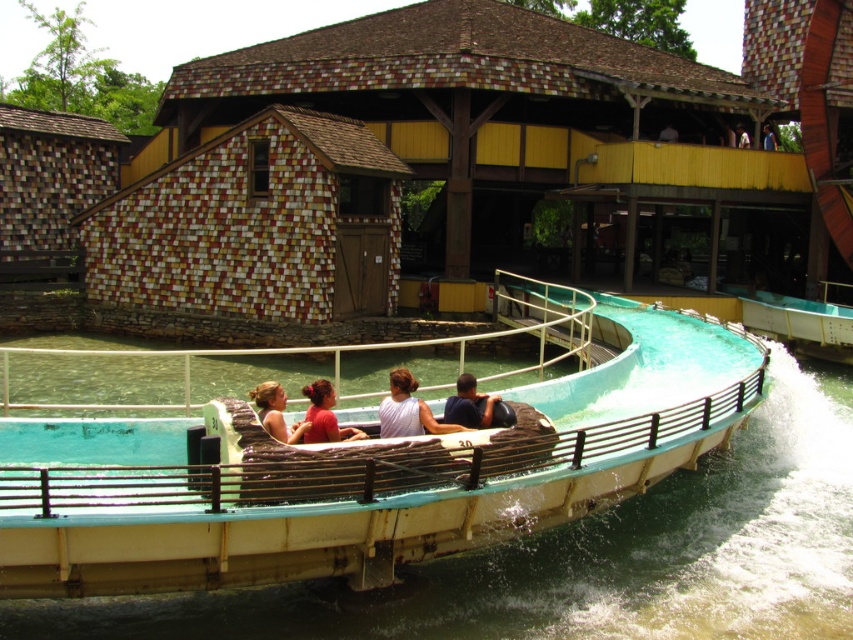
You are standing at the point marked as point (334, 420) in the amusement park water ride area. You want to walk towards the nearest exit, which is located 10 meters away from your current position. Can you safely reach the exit without needing to backtrack?

The distance between point (334, 420) and the viewer is 9.54 meters. Since the exit is 10 meters away from your current position, you can safely reach the exit without needing to backtrack as the distance is just slightly less than the required 10 meters.

You are an amusement park employee checking the water ride boats. You need to determine which boat is wider between the teal rubber boat at center and the matte brown boat at center. Which one is wider?

The teal rubber boat at center is wider than the matte brown boat at center according to the description.

You are a guest at the amusement park and want to take a photo of the matte brown boat at center and the white fabric person at upper center. Based on their positions, which object should you point your camera towards first to capture both in the same frame?

The matte brown boat at center is below the white fabric person at upper center, so you should point your camera towards the white fabric person at upper center first to ensure both are in the frame.